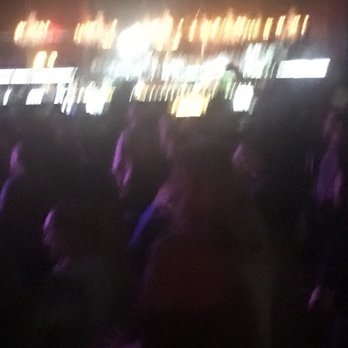
At what (x,y) coordinates should I click in order to perform the action: click on yellow light. Please return your answer as a coordinate pair (x, y). Looking at the image, I should click on (200, 97).